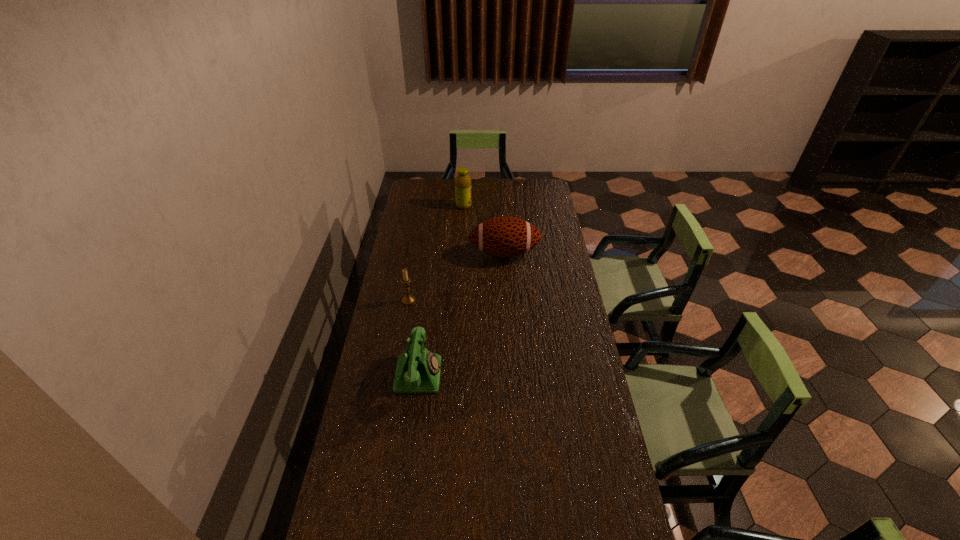
What are the coordinates of `object positioned at the right edge` in the screenshot? It's located at (505, 236).

Identify the location of vacant space at the far edge of the desktop. This screenshot has height=540, width=960. point(514,179).

Where is `vacant space at the left edge`? The image size is (960, 540). vacant space at the left edge is located at coordinates pyautogui.click(x=430, y=205).

Identify the location of blank space at the right edge of the desktop. (554, 333).

In the image, there is a desktop. Where is `vacant space at the far left corner`? This screenshot has height=540, width=960. vacant space at the far left corner is located at coordinates (422, 191).

Find the location of `vacant area that lies between the fruit juice and the telephone`. vacant area that lies between the fruit juice and the telephone is located at coordinates (442, 290).

You are a GUI agent. You are given a task and a screenshot of the screen. Output one action in this format:
    pyautogui.click(x=<x>, y=<y>)
    Task: Click on the vacant point located between the candle holder and the farthest object
    This screenshot has height=540, width=960.
    Given the screenshot: What is the action you would take?
    pyautogui.click(x=436, y=253)

Where is `vacant space that is in between the telephone and the third nearest object`? The image size is (960, 540). vacant space that is in between the telephone and the third nearest object is located at coordinates (462, 314).

The height and width of the screenshot is (540, 960). Identify the location of blank region between the third farthest object and the football. (457, 276).

Choose which object is the nearest neighbor to the telephone. Please provide its 2D coordinates. Your answer should be formatted as a tuple, i.e. [(x, y)], where the tuple contains the x and y coordinates of a point satisfying the conditions above.

[(408, 299)]